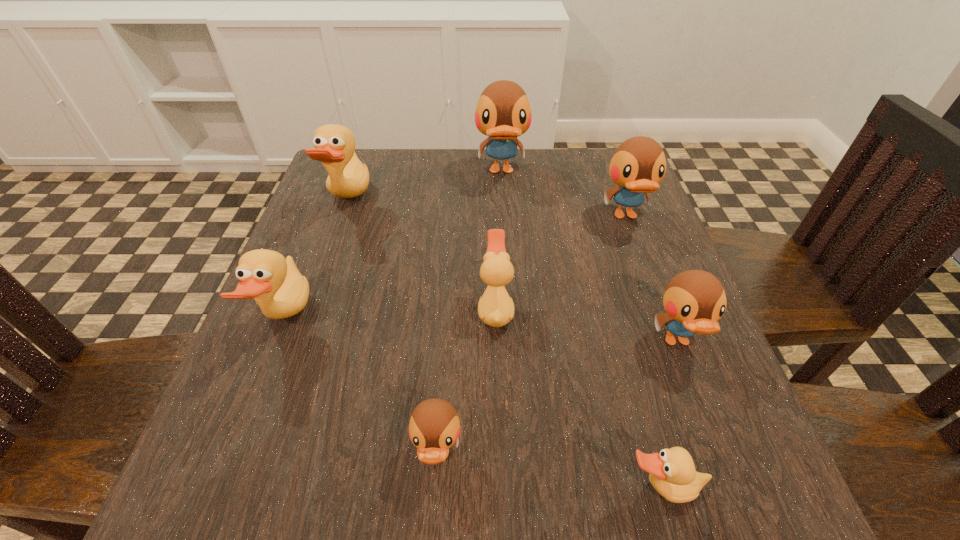
This screenshot has height=540, width=960. What are the coordinates of `object located in the far right corner section of the desktop` in the screenshot? It's located at (638, 165).

Locate an element on the screen. The image size is (960, 540). object at the near right corner is located at coordinates (672, 472).

Where is `vacant space at the far edge`? The width and height of the screenshot is (960, 540). vacant space at the far edge is located at coordinates (405, 201).

At what (x,y) coordinates should I click in order to perform the action: click on vacant space at the near edge of the desktop. Please return your answer as a coordinate pair (x, y). Looking at the image, I should click on (351, 516).

This screenshot has height=540, width=960. I want to click on vacant space at the left edge of the desktop, so click(310, 311).

In the image, there is a desktop. Identify the location of vacant area at the right edge. The image size is (960, 540). (647, 352).

You are a GUI agent. You are given a task and a screenshot of the screen. Output one action in this format:
    pyautogui.click(x=<x>, y=<y>)
    Task: Click on the vacant space at the far left corner of the desktop
    
    Given the screenshot: What is the action you would take?
    pos(372,195)

Find the location of `vacant region at the near left corner of the desktop`. vacant region at the near left corner of the desktop is located at coordinates (242, 514).

Where is `free region at the far right corner`? free region at the far right corner is located at coordinates (581, 186).

In the image, there is a desktop. Where is `vacant space at the near right corner`? The image size is (960, 540). vacant space at the near right corner is located at coordinates (734, 476).